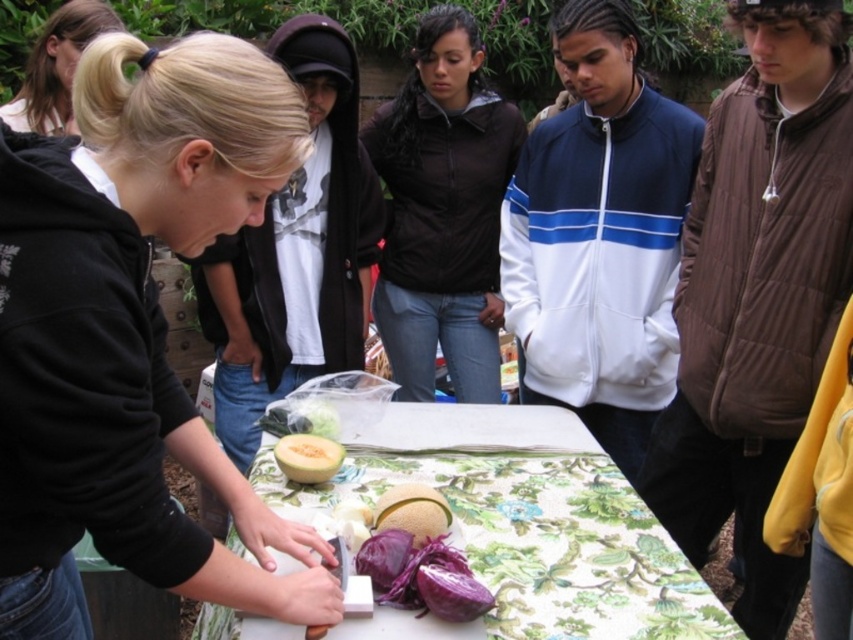
Locate an element on the screen. The image size is (853, 640). floral-patterned tablecloth at center is located at coordinates coord(529,520).

Is floral-patterned tablecloth at center to the left of smooth yellow cantaloupe at center from the viewer's perspective?

Incorrect, floral-patterned tablecloth at center is not on the left side of smooth yellow cantaloupe at center.

Who is more forward, (648, 586) or (315, 324)?

Positioned in front is point (648, 586).

Locate an element on the screen. The width and height of the screenshot is (853, 640). floral-patterned tablecloth at center is located at coordinates (529, 520).

Can you confirm if brown puffy vest at right is positioned to the left of purple matte cabbage at center?

In fact, brown puffy vest at right is to the right of purple matte cabbage at center.

Measure the distance from brown puffy vest at right to purple matte cabbage at center.

brown puffy vest at right is 3.69 feet away from purple matte cabbage at center.

Where is `brown puffy vest at right`? This screenshot has height=640, width=853. brown puffy vest at right is located at coordinates (758, 292).

Identify the location of brown puffy vest at right. click(x=758, y=292).

Consider the image. Does brown puffy vest at right have a greater height compared to smooth yellow cantaloupe at center?

Correct, brown puffy vest at right is much taller as smooth yellow cantaloupe at center.

You are a GUI agent. You are given a task and a screenshot of the screen. Output one action in this format:
    pyautogui.click(x=<x>, y=<y>)
    Task: Click on the brown puffy vest at right
    The width and height of the screenshot is (853, 640).
    Given the screenshot: What is the action you would take?
    pyautogui.click(x=758, y=292)

Does point (775, 424) come behind point (248, 276)?

No, it is not.

The image size is (853, 640). Identify the location of brown puffy vest at right. [x=758, y=292].